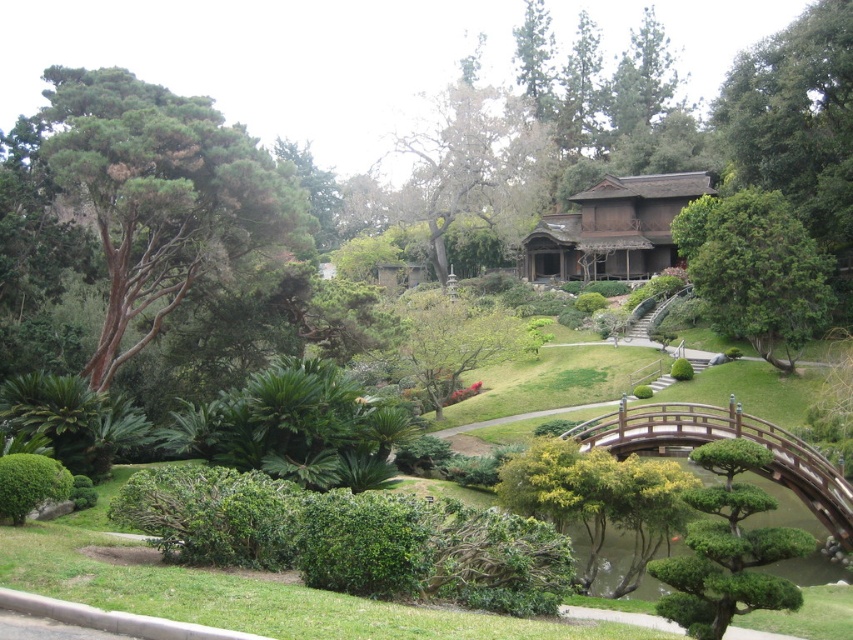
Who is taller, green textured tree at left or wooden bridge at center-right?

green textured tree at left is taller.

Between point (239, 218) and point (824, 481), which one is positioned behind?

Positioned behind is point (239, 218).

The height and width of the screenshot is (640, 853). In order to click on green textured tree at left in this screenshot , I will do `click(160, 196)`.

Which is below, green textured tree at left or green leafy tree at center?

Positioned lower is green textured tree at left.

Is green textured tree at left closer to camera compared to green leafy tree at center?

Yes.

Between point (120, 298) and point (758, 289), which one is positioned in front?

Positioned in front is point (120, 298).

Where is `green textured tree at left`? The height and width of the screenshot is (640, 853). green textured tree at left is located at coordinates (160, 196).

Describe the element at coordinates (755, 269) in the screenshot. The image size is (853, 640). I see `green leafy tree at center` at that location.

Is point (759, 349) less distant than point (701, 428)?

That is False.

In order to click on green leafy tree at center in this screenshot , I will do `click(755, 269)`.